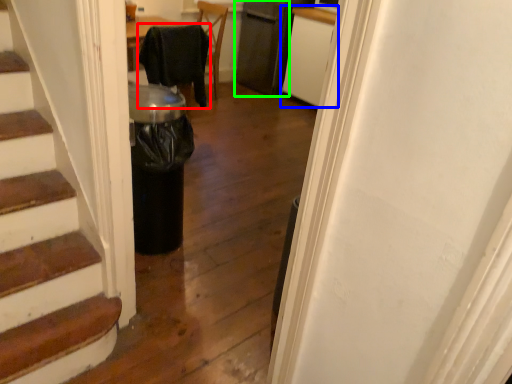
Question: Estimate the real-world distances between objects in this image. Which object is farther from chair (highlighted by a red box), cabinetry (highlighted by a blue box) or appliance (highlighted by a green box)?

Choices:
 (A) cabinetry
 (B) appliance

Answer: (B)